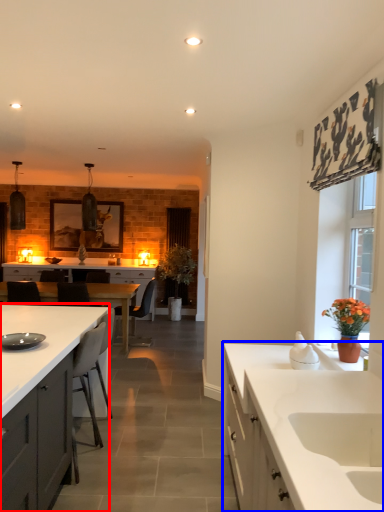
Question: Which object is closer to the camera taking this photo, cabinetry (highlighted by a red box) or countertop (highlighted by a blue box)?

Choices:
 (A) cabinetry
 (B) countertop

Answer: (A)